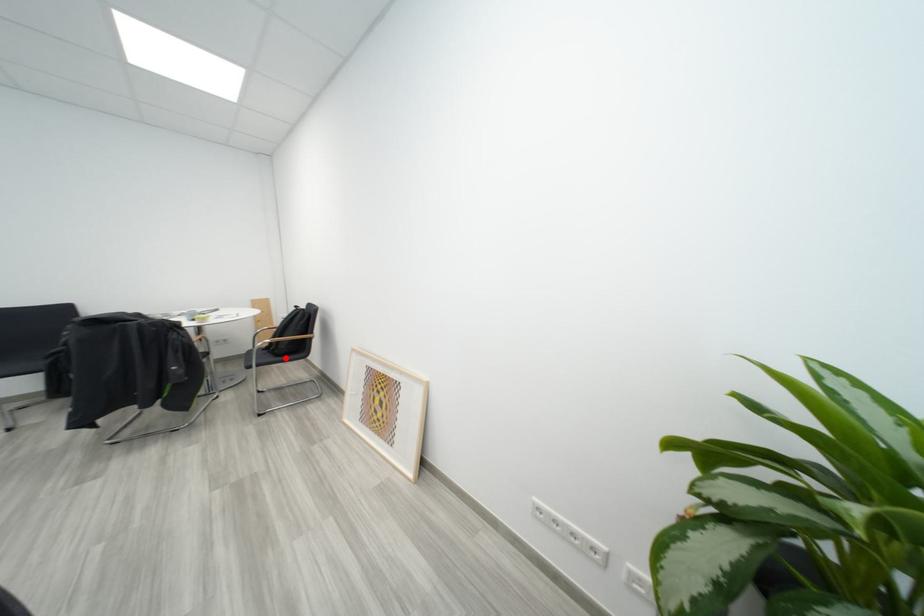
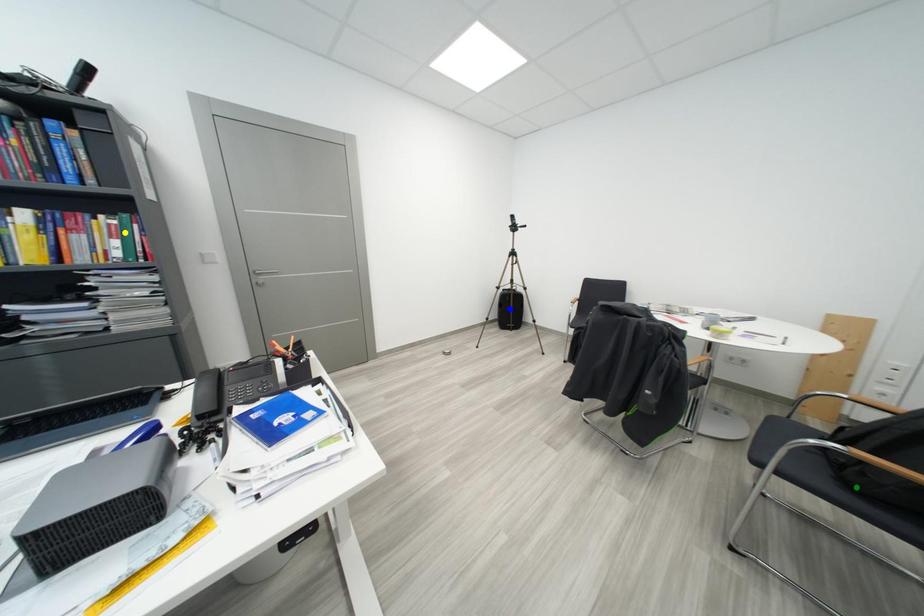
Question: I am providing you with two images of the same scene from different viewpoints. A red point is marked on the first image. You are given multiple points on the second image. Which spot in image 2 lines up with the point in image 1?

Choices:
 (A) green point
 (B) yellow point
 (C) blue point

Answer: (A)